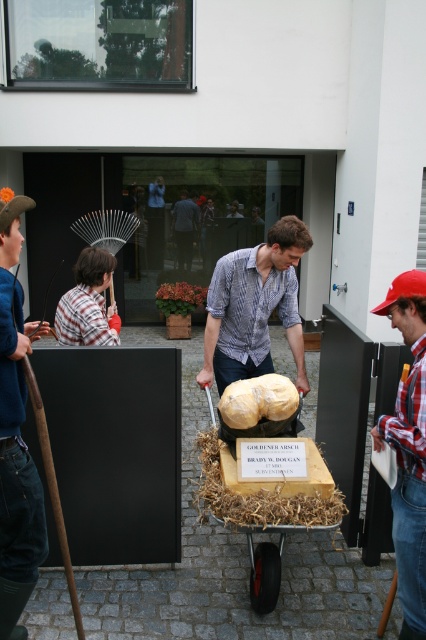
Does matte yellow cheese at center have a lesser height compared to red plaid shirt at lower right?

Indeed, matte yellow cheese at center has a lesser height compared to red plaid shirt at lower right.

Describe the element at coordinates (255, 307) in the screenshot. Image resolution: width=426 pixels, height=640 pixels. I see `matte yellow cheese at center` at that location.

Image resolution: width=426 pixels, height=640 pixels. In order to click on matte yellow cheese at center in this screenshot , I will do `click(255, 307)`.

Can you confirm if matte yellow cheese at center is thinner than dark blue shirt at center?

No, matte yellow cheese at center is not thinner than dark blue shirt at center.

Is point (242, 368) closer to camera compared to point (181, 202)?

Yes, it is.

The width and height of the screenshot is (426, 640). I want to click on matte yellow cheese at center, so click(255, 307).

Can you confirm if red plaid shirt at lower right is wider than yellow matte sculpture at center?

Incorrect, red plaid shirt at lower right's width does not surpass yellow matte sculpture at center's.

In the scene shown: Who is taller, red plaid shirt at lower right or yellow matte sculpture at center?

red plaid shirt at lower right is taller.

What do you see at coordinates (408, 449) in the screenshot? The width and height of the screenshot is (426, 640). I see `red plaid shirt at lower right` at bounding box center [408, 449].

The height and width of the screenshot is (640, 426). Identify the location of red plaid shirt at lower right. (408, 449).